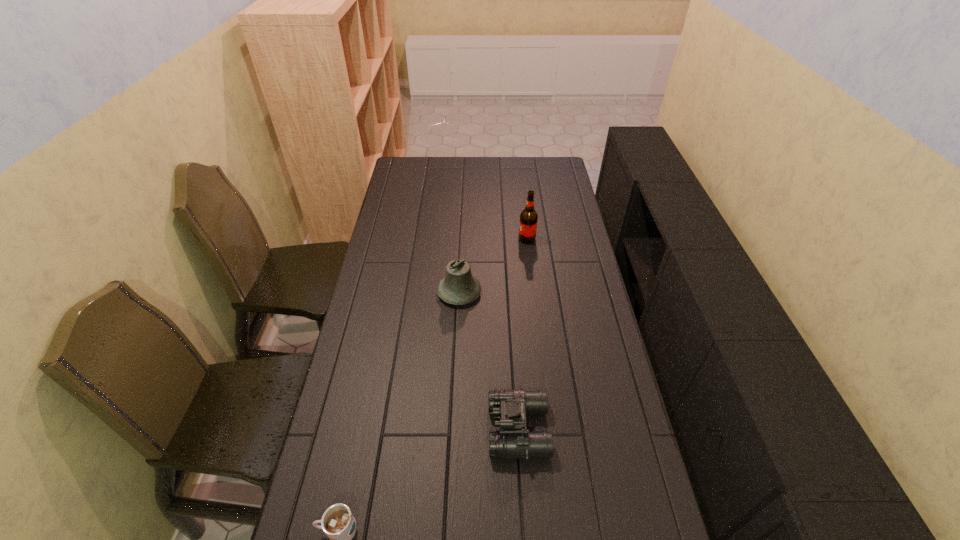
The image size is (960, 540). I want to click on the farthest object, so click(x=528, y=218).

Locate an element on the screen. The width and height of the screenshot is (960, 540). root beer is located at coordinates (528, 218).

This screenshot has width=960, height=540. I want to click on bell, so click(x=458, y=287).

Locate an element on the screen. Image resolution: width=960 pixels, height=540 pixels. the third object from right to left is located at coordinates (458, 287).

In order to click on the second nearest object in this screenshot , I will do `click(509, 407)`.

Where is `vacant area situated on the front of the root beer`? This screenshot has width=960, height=540. vacant area situated on the front of the root beer is located at coordinates (536, 314).

This screenshot has width=960, height=540. I want to click on free spot located on the back of the bell, so click(463, 230).

In order to click on vacant space situated through the lenses of the binoculars in this screenshot , I will do `click(364, 429)`.

Locate an element on the screen. vacant space located 0.300m through the lenses of the binoculars is located at coordinates (382, 429).

Where is `free region located through the lenses of the binoculars`? The height and width of the screenshot is (540, 960). free region located through the lenses of the binoculars is located at coordinates (364, 429).